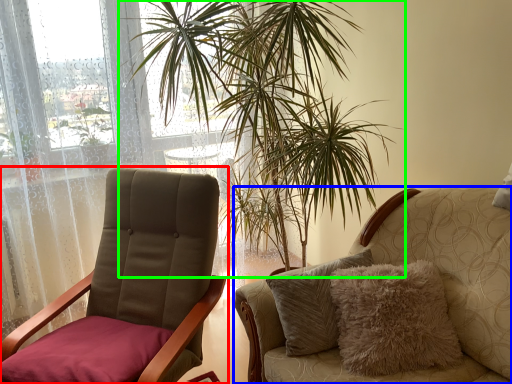
Question: Estimate the real-world distances between objects in this image. Which object is farther from chair (highlighted by a red box), chair (highlighted by a blue box) or houseplant (highlighted by a green box)?

Choices:
 (A) chair
 (B) houseplant

Answer: (B)